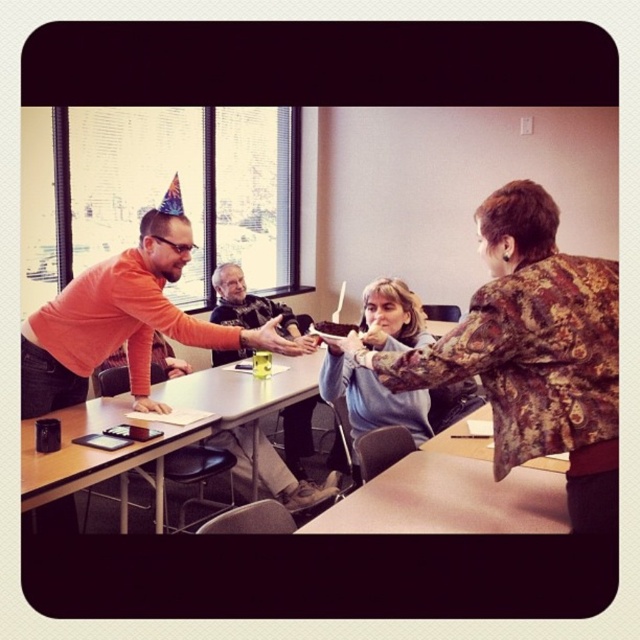
Question: Where is orange matte shirt at left located in relation to black leather jacket at center in the image?

Choices:
 (A) below
 (B) above

Answer: (A)

Question: Does floral-patterned blouse at center appear over orange matte shirt at left?

Choices:
 (A) no
 (B) yes

Answer: (A)

Question: Based on their relative distances, which object is nearer to the orange matte shirt at left?

Choices:
 (A) black leather jacket at center
 (B) light blue sweater at center
 (C) black plastic table at lower left
 (D) floral-patterned blouse at center

Answer: (C)

Question: Estimate the real-world distances between objects in this image. Which object is farther from the orange matte shirt at left?

Choices:
 (A) black leather jacket at center
 (B) black plastic table at lower left
 (C) light blue sweater at center
 (D) floral-patterned blouse at center

Answer: (A)

Question: Which of the following is the farthest from the observer?

Choices:
 (A) (227, 289)
 (B) (408, 419)

Answer: (A)

Question: Can you confirm if orange matte shirt at left is wider than black plastic table at lower left?

Choices:
 (A) yes
 (B) no

Answer: (A)